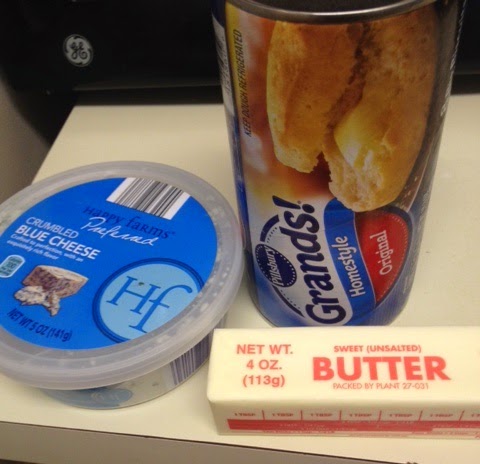
Locate an element on the screen. front edge of table is located at coordinates (48, 436), (157, 452), (244, 457).